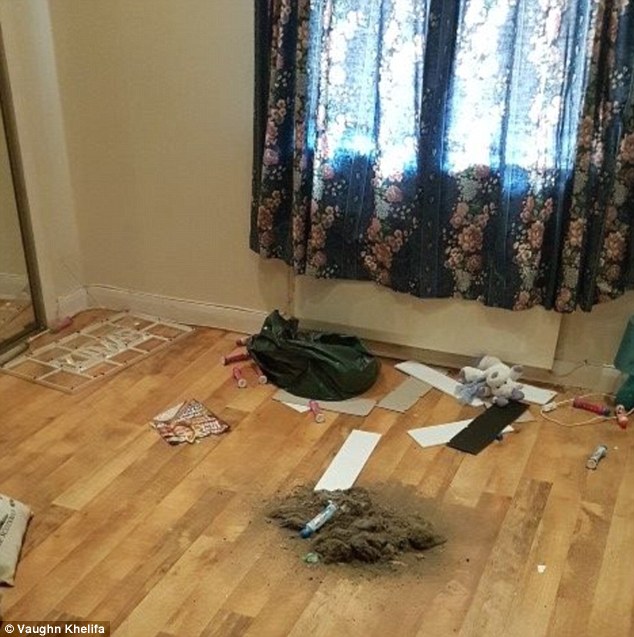
Where is `small white boards`? small white boards is located at coordinates (345, 459), (434, 434), (444, 373), (536, 390), (337, 364).